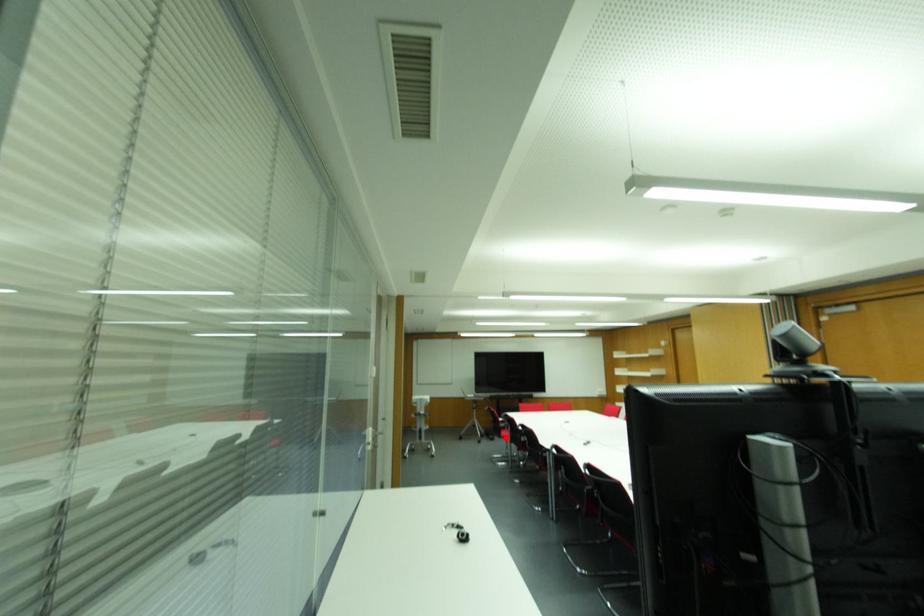
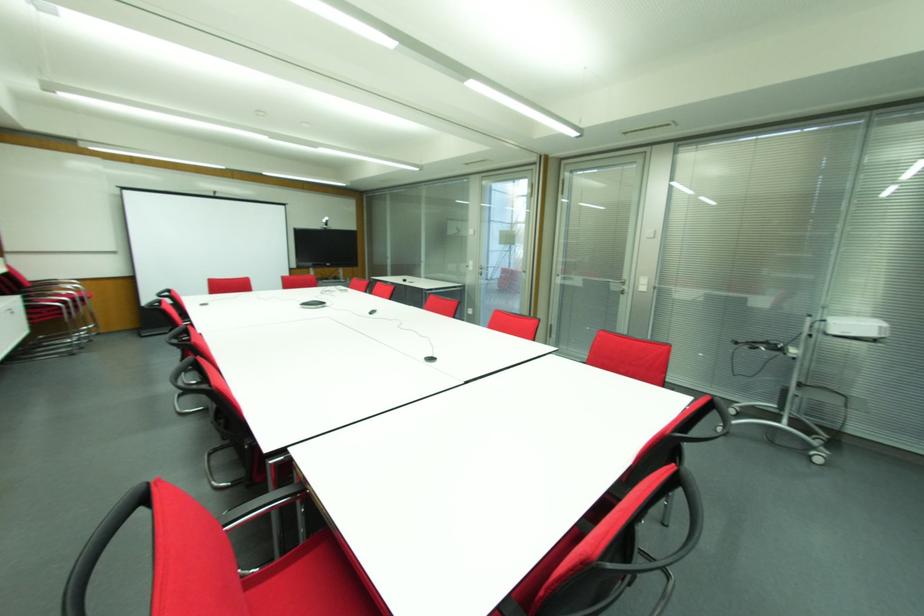
Question: I am providing you with two images of the same scene from different viewpoints. A red point is marked on the first image. Can you still see the location of the red point in image 2?

Choices:
 (A) Yes
 (B) No

Answer: (B)